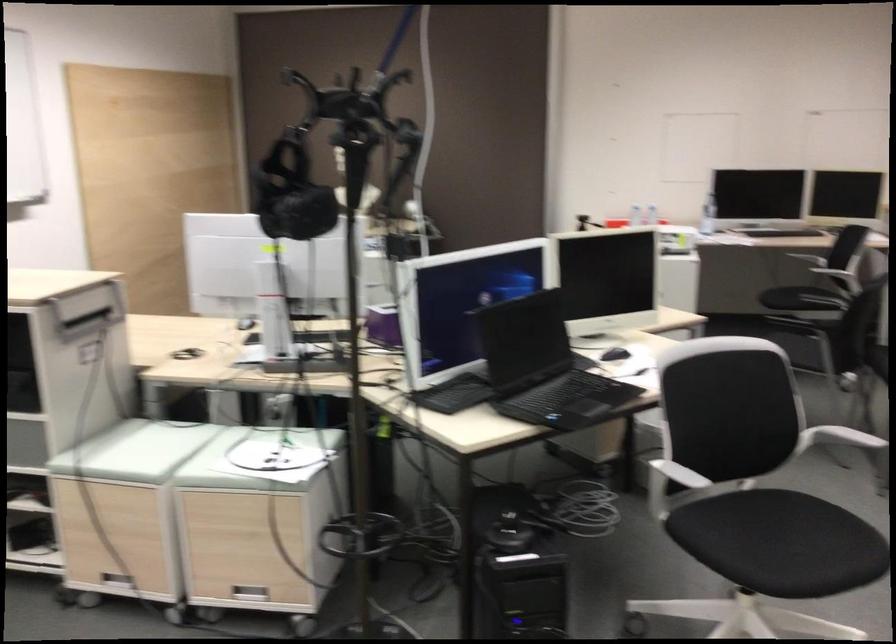
Locate an element on the screen. black VR headset is located at coordinates (291, 192).